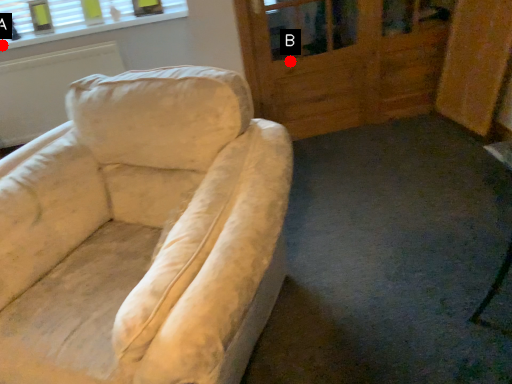
Question: Two points are circled on the image, labeled by A and B beside each circle. Among these points, which one is farthest from the camera?

Choices:
 (A) A is further
 (B) B is further

Answer: (A)